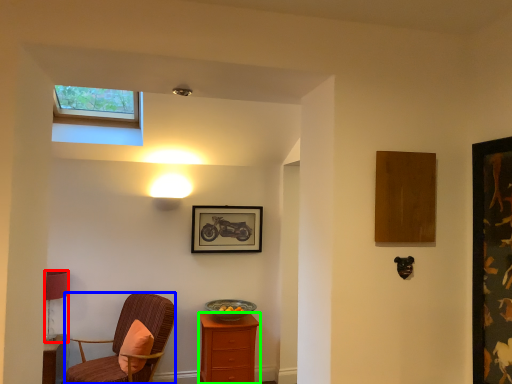
Question: Estimate the real-world distances between objects in this image. Which object is closer to lamp (highlighted by a red box), chair (highlighted by a blue box) or nightstand (highlighted by a green box)?

Choices:
 (A) chair
 (B) nightstand

Answer: (A)